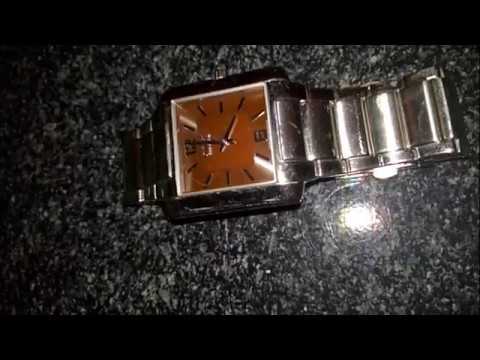
Locate an element on the screen. This screenshot has height=360, width=480. square frame is located at coordinates (196, 206).